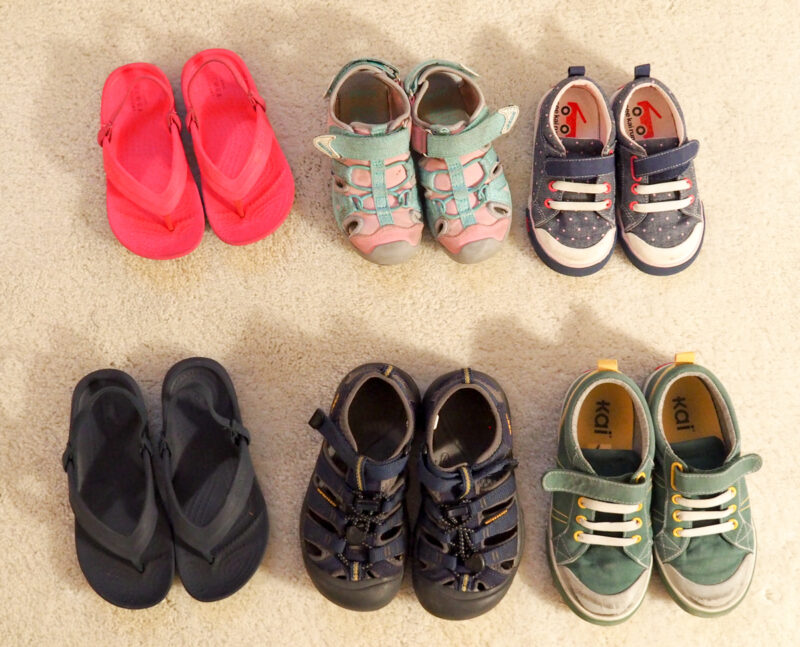
The width and height of the screenshot is (800, 647). What are the coordinates of `shoe in bottom row` in the screenshot? It's located at (136, 534), (216, 534), (342, 542), (462, 545), (596, 543), (721, 567).